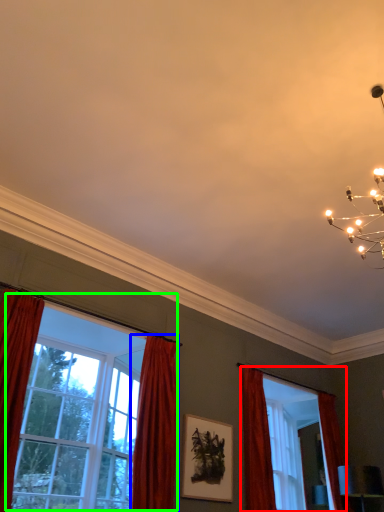
Question: Considering the real-world distances, which object is closest to window (highlighted by a red box)? curtain (highlighted by a blue box) or window (highlighted by a green box).

Choices:
 (A) curtain
 (B) window

Answer: (A)